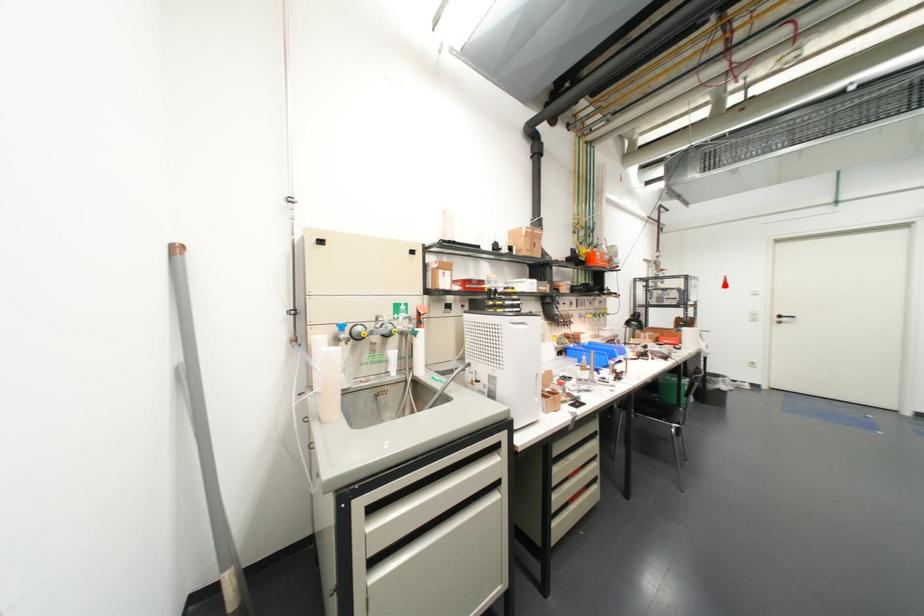
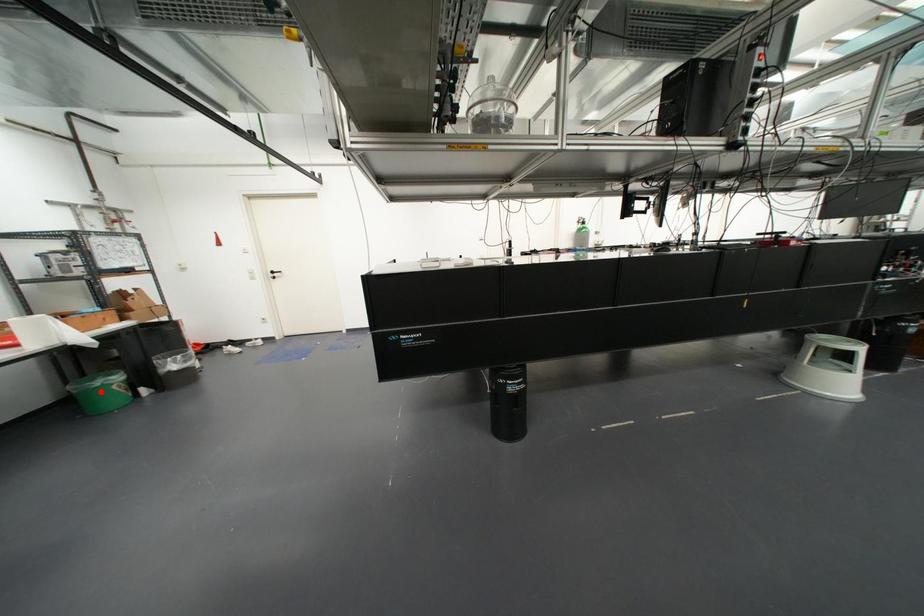
I am providing you with two images of the same scene from different viewpoints. A red point is marked on the first image and another point is marked on the second image. Does the point marked in image1 correspond to the same location as the one in image2?

No